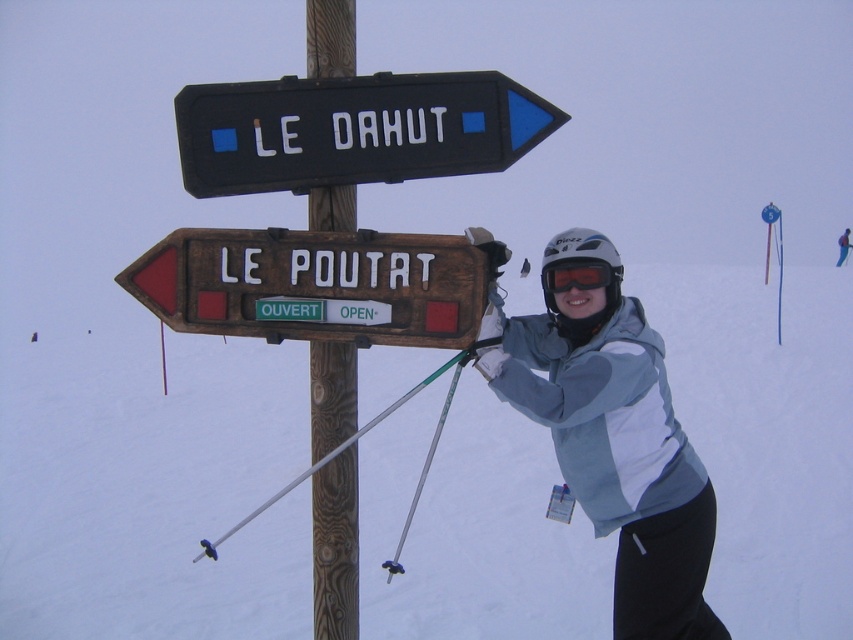
You are a winter sports enthusiast planning to put on your gear. You currently have your light blue fabric jacket at center and orange reflective goggles at center. Which item should you put on first based on their current positions?

The light blue fabric jacket at center is closer to the viewer than the orange reflective goggles at center, so you should put on the light blue fabric jacket at center first.